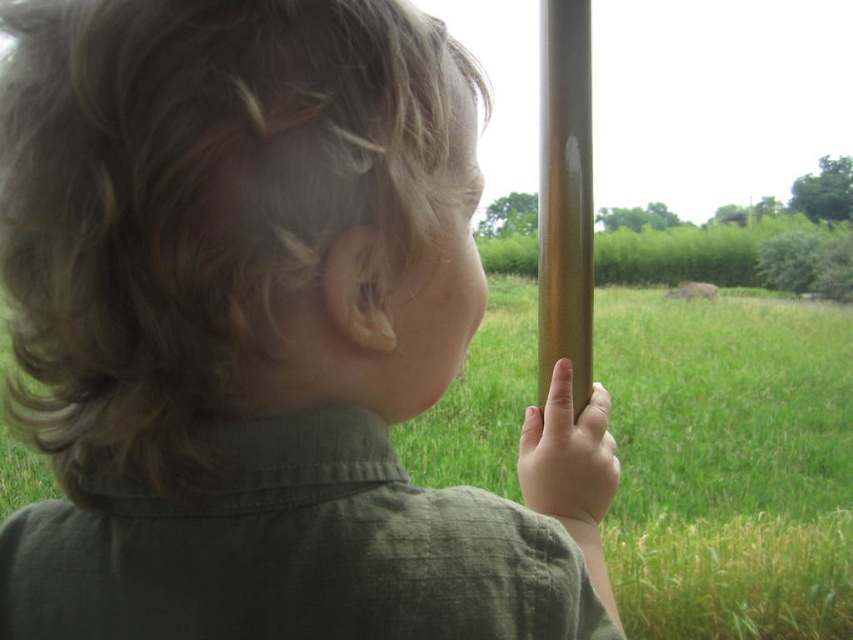
Question: Can you confirm if matte green shirt at center is positioned above shiny metallic pole at center?

Choices:
 (A) yes
 (B) no

Answer: (B)

Question: Is green grass at center positioned before shiny metallic pole at center?

Choices:
 (A) yes
 (B) no

Answer: (A)

Question: Which object appears closest to the camera in this image?

Choices:
 (A) shiny metallic pole at center
 (B) green grass at center
 (C) pink matte finger at center

Answer: (B)

Question: Which object is positioned closest to the pink matte finger at center?

Choices:
 (A) matte green shirt at center
 (B) green grass at center

Answer: (A)

Question: Is shiny metallic pole at center above pink matte finger at center?

Choices:
 (A) yes
 (B) no

Answer: (A)

Question: Among these objects, which one is farthest from the camera?

Choices:
 (A) green grass at center
 (B) shiny metallic pole at center
 (C) pink matte finger at center

Answer: (B)